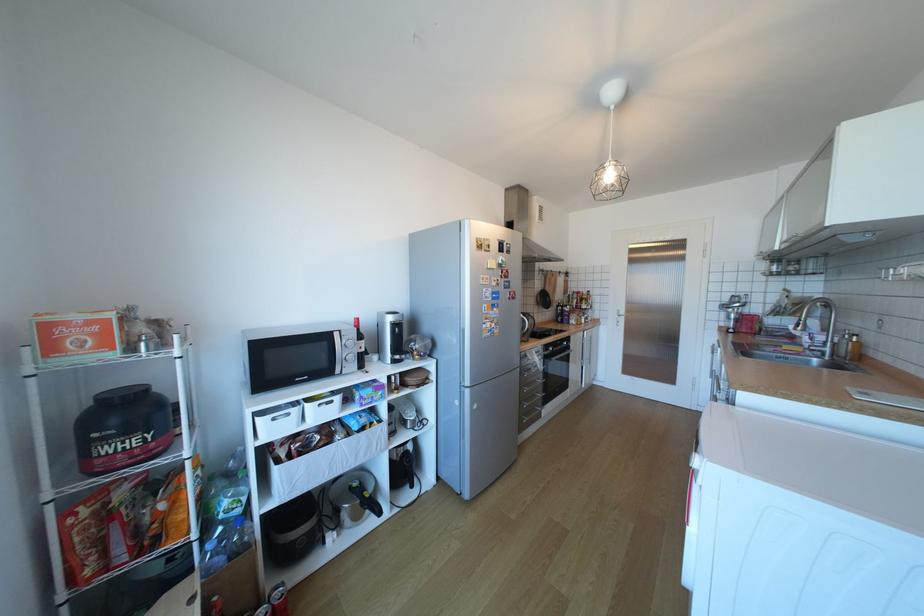
Image resolution: width=924 pixels, height=616 pixels. Describe the element at coordinates (373, 506) in the screenshot. I see `a black appliance handle` at that location.